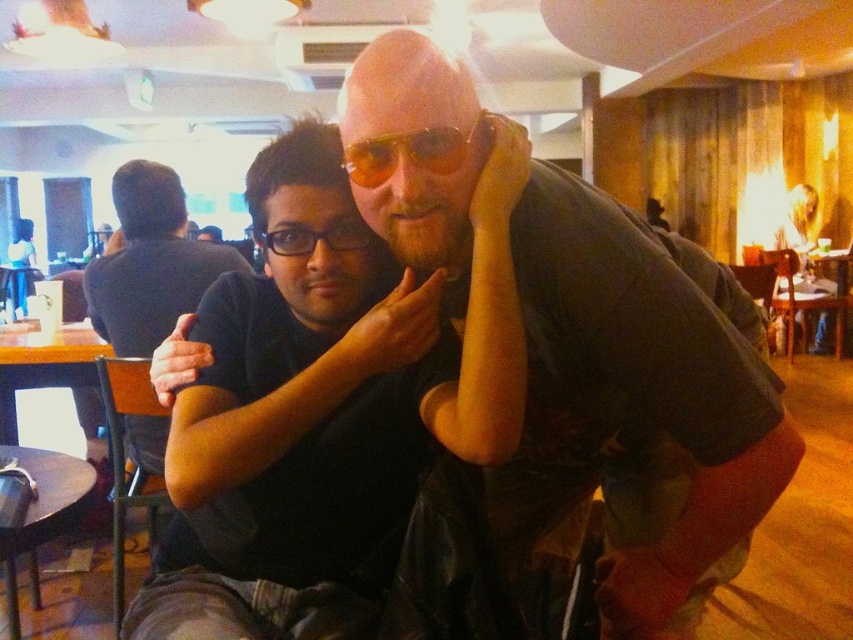
Question: Considering the real-world distances, which object is closest to the matte black shirt at center?

Choices:
 (A) black matte shirt at left
 (B) matte wooden table at left
 (C) black matte shirt at center

Answer: (C)

Question: Which object appears farthest from the camera in this image?

Choices:
 (A) yellow tinted plastic glasses at center
 (B) black plastic glasses at center

Answer: (B)

Question: Observing the image, what is the correct spatial positioning of black matte shirt at center in reference to matte wooden table at left?

Choices:
 (A) below
 (B) above

Answer: (B)

Question: Can you confirm if dark wood table at lower left is positioned to the right of matte skin hand at center?

Choices:
 (A) no
 (B) yes

Answer: (A)

Question: Which of the following is the farthest from the observer?

Choices:
 (A) matte wooden table at left
 (B) black plastic glasses at center
 (C) matte skin hand at center
 (D) dark wood table at lower left

Answer: (A)

Question: Does matte black shirt at center appear over yellow tinted plastic glasses at center?

Choices:
 (A) no
 (B) yes

Answer: (A)